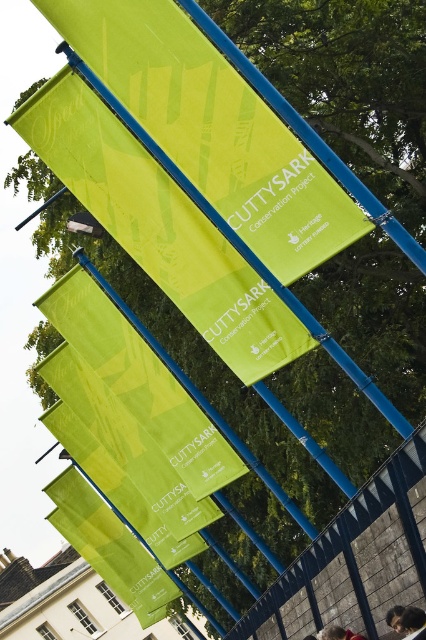
Question: Which point is closer to the camera?

Choices:
 (A) brown hair at lower right
 (B) reddish-brown leather jacket at lower center
 (C) dark brown hair at lower right

Answer: (C)

Question: Is green fabric banner at center bigger than dark brown hair at lower right?

Choices:
 (A) no
 (B) yes

Answer: (B)

Question: Is dark brown hair at lower right further to camera compared to reddish-brown leather jacket at lower center?

Choices:
 (A) no
 (B) yes

Answer: (A)

Question: Which point is closer to the camera?

Choices:
 (A) (331, 627)
 (B) (291, 234)
 (C) (374, 486)

Answer: (B)

Question: Is blue metal fence at center thinner than brown hair at lower right?

Choices:
 (A) no
 (B) yes

Answer: (A)

Question: Estimate the real-world distances between objects in this image. Which object is farther from the blue metal fence at center?

Choices:
 (A) green fabric banner at center
 (B) dark brown hair at lower right
 (C) brown hair at lower right

Answer: (A)